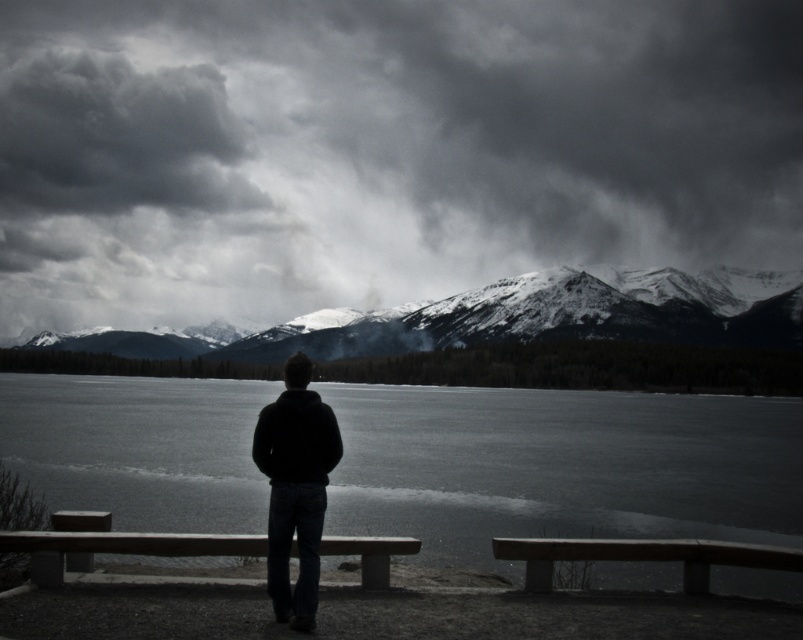
Which of these two, cloudy sky at upper center or black matte jacket at center, stands shorter?

black matte jacket at center

Is cloudy sky at upper center positioned at the back of black matte jacket at center?

Yes, it is behind black matte jacket at center.

From the picture: Who is more forward, (760, 168) or (263, 432)?

Point (263, 432)

The height and width of the screenshot is (640, 803). I want to click on cloudy sky at upper center, so click(x=380, y=150).

Which is in front, point (347, 326) or point (14, 196)?

Point (347, 326)

Is point (314, 337) closer to viewer compared to point (131, 157)?

Yes, it is in front of point (131, 157).

Identify the location of snowy mountain at center. (508, 317).

Measure the distance between smooth ice at center and wooden bench at center.

smooth ice at center is 310.75 feet away from wooden bench at center.

Describe the element at coordinates (561, 467) in the screenshot. The height and width of the screenshot is (640, 803). I see `smooth ice at center` at that location.

Identify the location of smooth ice at center. (561, 467).